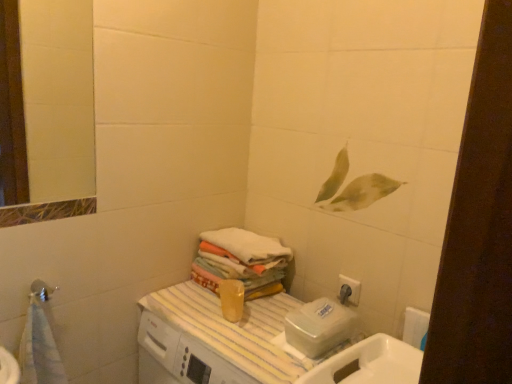
Question: Is white matte toilet paper at lower right wider than matte silver shower head at lower left?

Choices:
 (A) no
 (B) yes

Answer: (A)

Question: From the image's perspective, is white matte toilet paper at lower right on top of matte silver shower head at lower left?

Choices:
 (A) no
 (B) yes

Answer: (A)

Question: Does white matte toilet paper at lower right lie in front of matte silver shower head at lower left?

Choices:
 (A) no
 (B) yes

Answer: (A)

Question: Can you confirm if white matte toilet paper at lower right is positioned to the left of matte silver shower head at lower left?

Choices:
 (A) yes
 (B) no

Answer: (B)

Question: From a real-world perspective, is white matte toilet paper at lower right physically above matte silver shower head at lower left?

Choices:
 (A) yes
 (B) no

Answer: (B)

Question: In terms of height, does matte silver shower head at lower left look taller or shorter compared to white soft towel at center?

Choices:
 (A) tall
 (B) short

Answer: (A)

Question: Considering the positions of matte silver shower head at lower left and white soft towel at center in the image, is matte silver shower head at lower left wider or thinner than white soft towel at center?

Choices:
 (A) thin
 (B) wide

Answer: (A)

Question: From the image's perspective, relative to white soft towel at center, is matte silver shower head at lower left above or below?

Choices:
 (A) above
 (B) below

Answer: (B)

Question: Relative to white soft towel at center, is matte silver shower head at lower left in front or behind?

Choices:
 (A) front
 (B) behind

Answer: (A)

Question: From the image's perspective, is white glossy sink at lower right above or below matte silver shower head at lower left?

Choices:
 (A) above
 (B) below

Answer: (B)

Question: Visually, is white glossy sink at lower right positioned to the left or to the right of matte silver shower head at lower left?

Choices:
 (A) right
 (B) left

Answer: (A)

Question: Is white glossy sink at lower right in front of or behind matte silver shower head at lower left in the image?

Choices:
 (A) front
 (B) behind

Answer: (A)

Question: In terms of width, does white glossy sink at lower right look wider or thinner when compared to matte silver shower head at lower left?

Choices:
 (A) wide
 (B) thin

Answer: (A)

Question: From a real-world perspective, is matte silver shower head at lower left above or below white matte toilet paper at lower right?

Choices:
 (A) below
 (B) above

Answer: (B)

Question: Visually, is matte silver shower head at lower left positioned to the left or to the right of white matte toilet paper at lower right?

Choices:
 (A) right
 (B) left

Answer: (B)